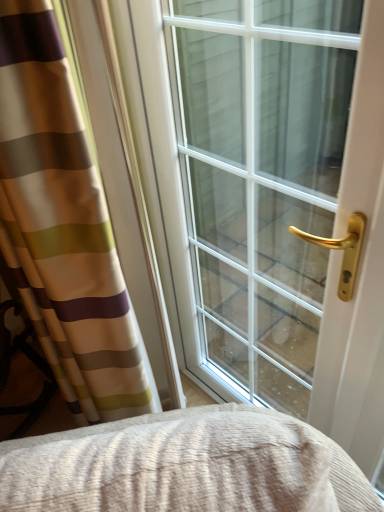
Question: From a real-world perspective, is clear glass window at center on striped fabric curtain at left?

Choices:
 (A) yes
 (B) no

Answer: (B)

Question: Is clear glass window at center wider than striped fabric curtain at left?

Choices:
 (A) yes
 (B) no

Answer: (A)

Question: Can you confirm if clear glass window at center is smaller than striped fabric curtain at left?

Choices:
 (A) no
 (B) yes

Answer: (A)

Question: Is clear glass window at center positioned with its back to striped fabric curtain at left?

Choices:
 (A) yes
 (B) no

Answer: (B)

Question: Does clear glass window at center lie in front of striped fabric curtain at left?

Choices:
 (A) yes
 (B) no

Answer: (B)

Question: Does clear glass window at center turn towards striped fabric curtain at left?

Choices:
 (A) no
 (B) yes

Answer: (B)

Question: Considering the relative sizes of striped fabric curtain at left and clear glass window at center in the image provided, is striped fabric curtain at left taller than clear glass window at center?

Choices:
 (A) yes
 (B) no

Answer: (B)

Question: Does striped fabric curtain at left have a larger size compared to clear glass window at center?

Choices:
 (A) no
 (B) yes

Answer: (A)

Question: Is striped fabric curtain at left closer to the viewer compared to clear glass window at center?

Choices:
 (A) yes
 (B) no

Answer: (A)

Question: Is striped fabric curtain at left at the right side of clear glass window at center?

Choices:
 (A) yes
 (B) no

Answer: (B)

Question: From the image's perspective, is striped fabric curtain at left located above clear glass window at center?

Choices:
 (A) yes
 (B) no

Answer: (B)

Question: Is striped fabric curtain at left wider than clear glass window at center?

Choices:
 (A) yes
 (B) no

Answer: (B)

Question: Looking at the image, does clear glass window at center seem bigger or smaller compared to striped fabric curtain at left?

Choices:
 (A) big
 (B) small

Answer: (A)